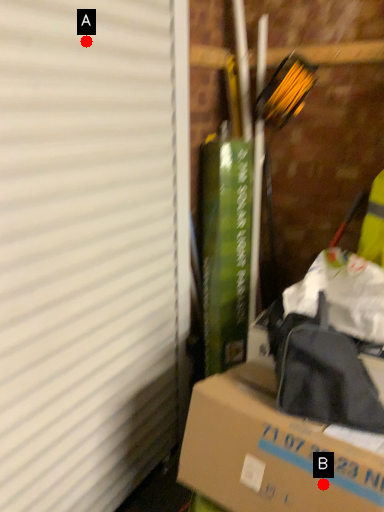
Question: Two points are circled on the image, labeled by A and B beside each circle. Which point is farther from the camera taking this photo?

Choices:
 (A) A is further
 (B) B is further

Answer: (A)